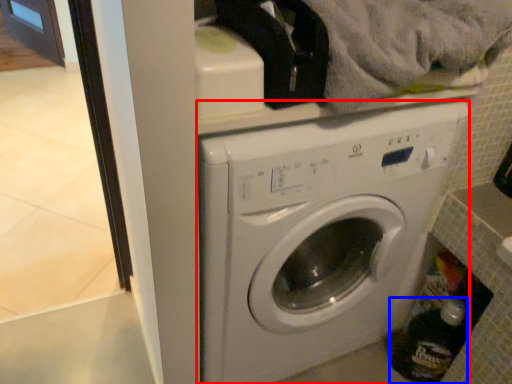
Question: Which object appears farthest to the camera in this image, washing machine (highlighted by a red box) or bottle (highlighted by a blue box)?

Choices:
 (A) washing machine
 (B) bottle

Answer: (B)